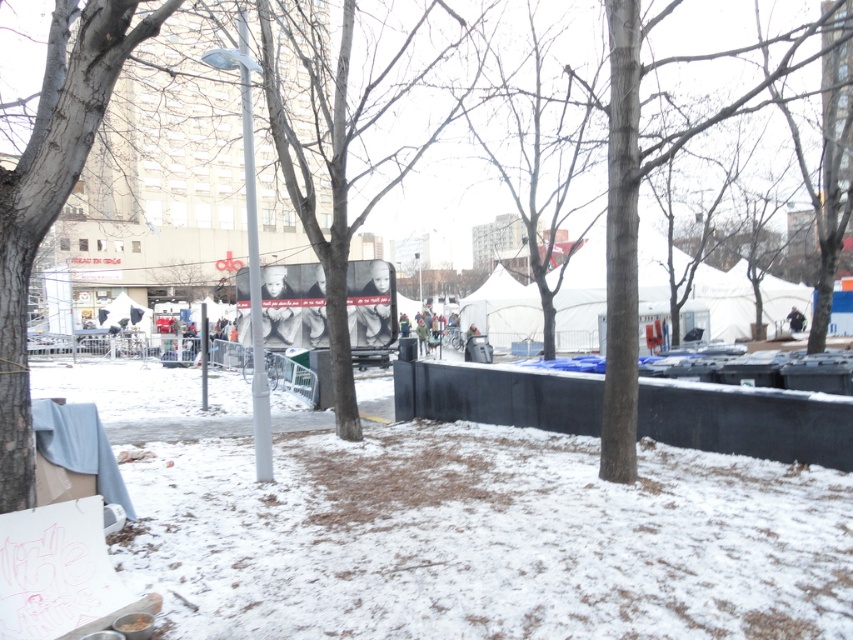
Question: Among these objects, which one is nearest to the camera?

Choices:
 (A) gray bark tree at left
 (B) smooth gray tree at center

Answer: (A)

Question: Can you confirm if smooth gray tree at center is bigger than gray bark tree at left?

Choices:
 (A) yes
 (B) no

Answer: (A)

Question: Where is smooth gray tree at center located in relation to gray bark tree at left in the image?

Choices:
 (A) left
 (B) right

Answer: (B)

Question: Considering the relative positions of smooth gray tree at center and gray bark tree at left in the image provided, where is smooth gray tree at center located with respect to gray bark tree at left?

Choices:
 (A) right
 (B) left

Answer: (A)

Question: Which point appears farthest from the camera in this image?

Choices:
 (A) (395, 177)
 (B) (21, 253)

Answer: (A)